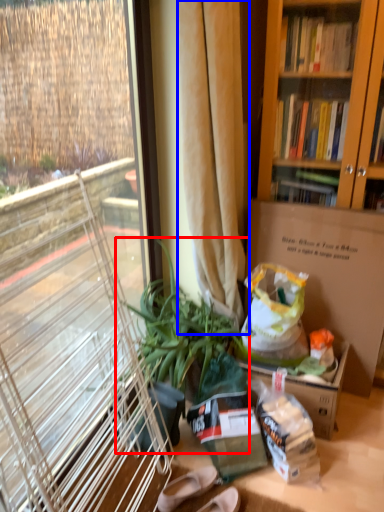
Question: Which of the following is the farthest to the observer, houseplant (highlighted by a red box) or curtain (highlighted by a blue box)?

Choices:
 (A) houseplant
 (B) curtain

Answer: (A)